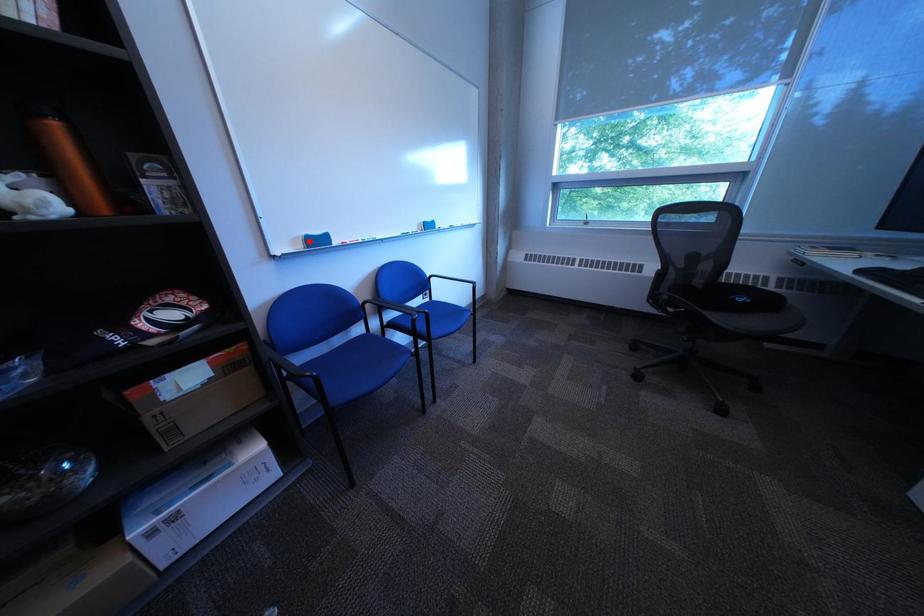
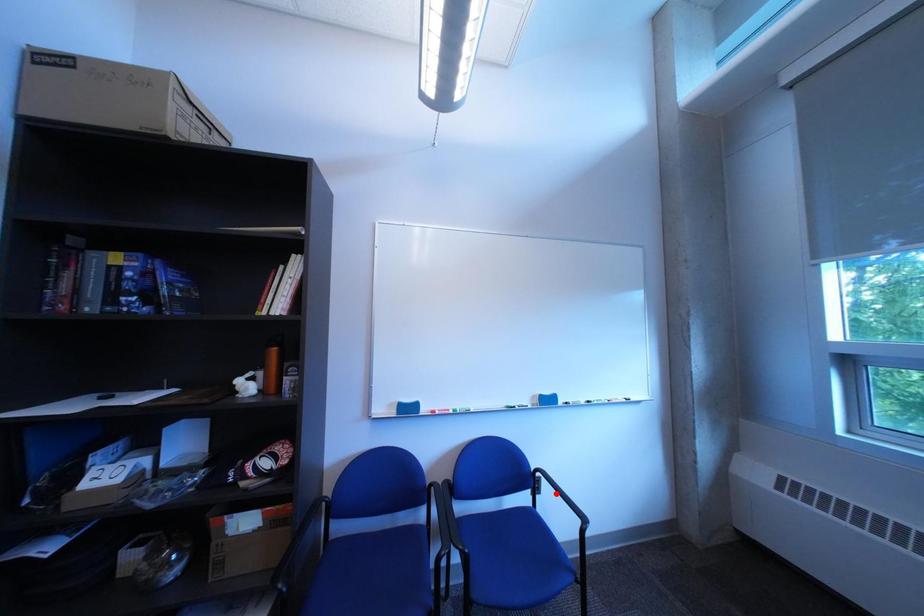
I am providing you with two images of the same scene from different viewpoints. A red point is marked on the first image and another point is marked on the second image. Are the points marked in image1 and image2 representing the same 3D position?

No